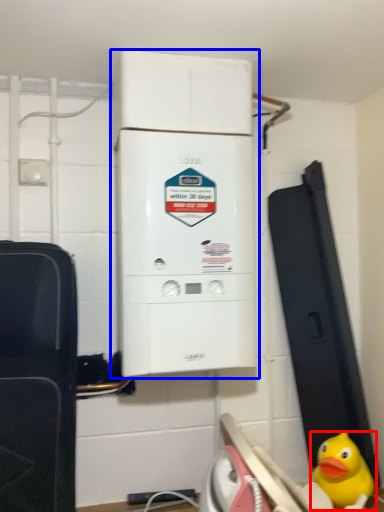
Question: Which of the following is the farthest to the observer, toy (highlighted by a red box) or home appliance (highlighted by a blue box)?

Choices:
 (A) toy
 (B) home appliance

Answer: (A)